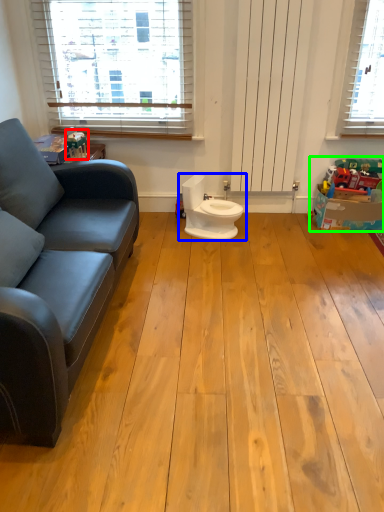
Question: Estimate the real-world distances between objects in this image. Which object is farther from toy (highlighted by a red box), toilet (highlighted by a blue box) or toy (highlighted by a green box)?

Choices:
 (A) toilet
 (B) toy

Answer: (B)